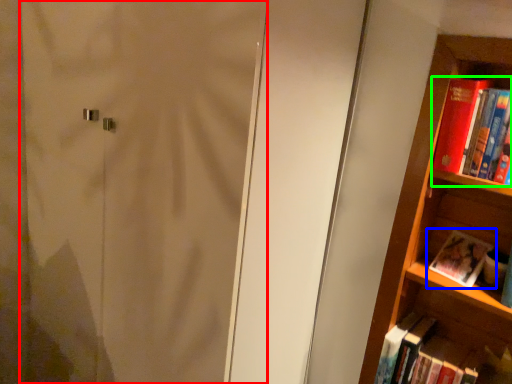
Question: Which object is the closest to the screen door (highlighted by a red box)? Choose among these: book (highlighted by a blue box) or book (highlighted by a green box).

Choices:
 (A) book
 (B) book

Answer: (B)